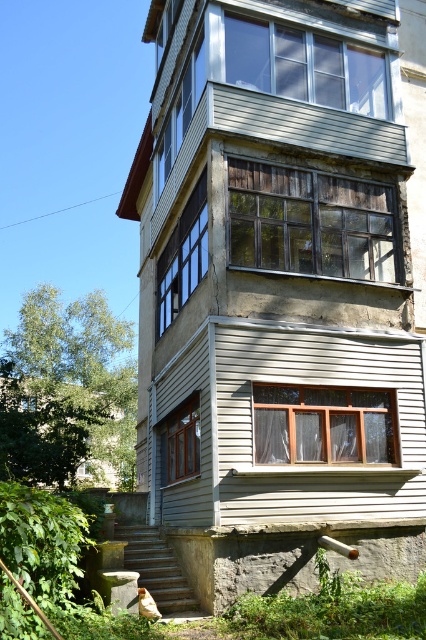
Can you confirm if clear glass window at upper center is positioned above translucent wood window at center?

Yes, clear glass window at upper center is above translucent wood window at center.

Who is more distant from viewer, [290,76] or [377,451]?

The point [290,76] is behind.

Locate an element on the screen. The height and width of the screenshot is (640, 426). clear glass window at upper center is located at coordinates (304, 65).

Is translucent wood window at center above wooden frame at lower center?

Correct, translucent wood window at center is located above wooden frame at lower center.

From the picture: Can you confirm if translucent wood window at center is bigger than wooden frame at lower center?

Incorrect, translucent wood window at center is not larger than wooden frame at lower center.

Between point (319, 449) and point (169, 420), which one is positioned in front?

Point (319, 449) is more forward.

In order to click on translucent wood window at center in this screenshot , I will do `click(322, 424)`.

Between point (175, 269) and point (175, 449), which one is positioned in front?

Point (175, 449)

Which is above, wooden frame at center or wooden frame at lower center?

wooden frame at center

Which is behind, point (172, 230) or point (196, 400)?

The point (172, 230) is behind.

Where is `wooden frame at center`? The width and height of the screenshot is (426, 640). wooden frame at center is located at coordinates (183, 257).